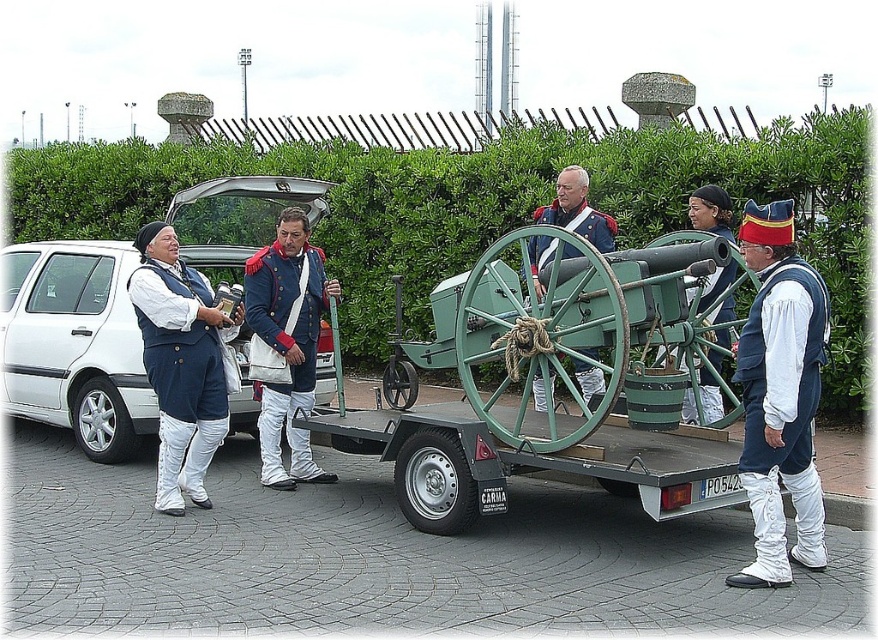
Question: Can you confirm if matte blue vest at left is bigger than matte blue uniform at center?

Choices:
 (A) no
 (B) yes

Answer: (A)

Question: Which of the following is the closest to the observer?

Choices:
 (A) (466, 280)
 (B) (304, 326)
 (C) (731, 305)
 (D) (786, 477)

Answer: (D)

Question: Can you confirm if green leafy hedge at upper center is positioned to the right of matte blue uniform at center?

Choices:
 (A) yes
 (B) no

Answer: (B)

Question: Which object appears closest to the camera in this image?

Choices:
 (A) blue fabric uniform at center
 (B) matte blue vest at left
 (C) white matte car at left
 (D) green wooden cart at center

Answer: (D)

Question: Which of the following is the farthest from the observer?

Choices:
 (A) blue fabric uniform at center
 (B) green leafy hedge at upper center
 (C) green wooden cart at center

Answer: (B)

Question: Is green leafy hedge at upper center thinner than white matte car at left?

Choices:
 (A) yes
 (B) no

Answer: (B)